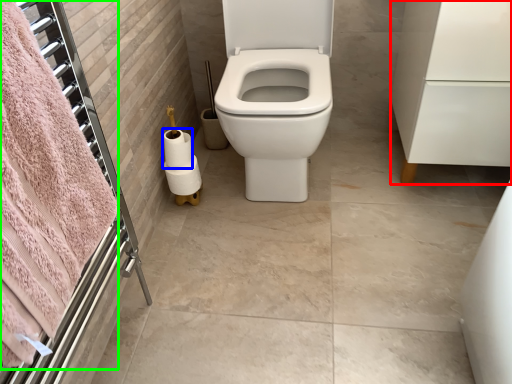
Question: Which object is positioned farthest from porcelain (highlighted by a red box)? Select from toilet paper (highlighted by a blue box) and bath towel (highlighted by a green box).

Choices:
 (A) toilet paper
 (B) bath towel

Answer: (B)